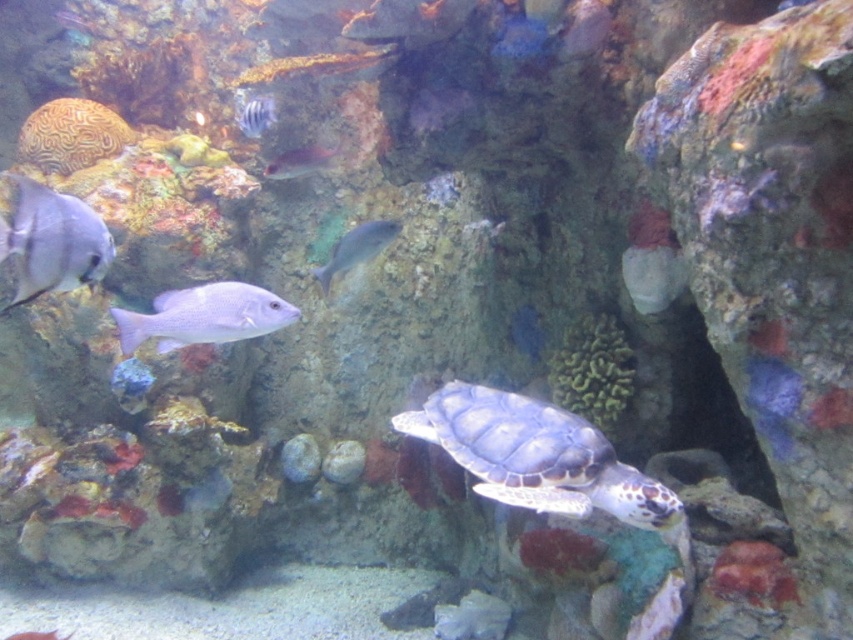
Based on the photo, you are a marine biologist observing this underwater scene. You notice the translucent pinkish fish at upper center and the shiny silver fish at lower left. Which fish is positioned higher in the water column?

The translucent pinkish fish at upper center is positioned higher in the water column than the shiny silver fish at lower left.

You are a marine biologist observing the underwater scene. You notice the satin silver fish at center. Can you determine its exact coordinates in the image?

The satin silver fish at center is located at coordinates point (357,248).

You are a marine biologist observing an underwater scene. You notice a point marked at coordinates (537, 456). Based on the scene description, which object does this point correspond to?

The point at coordinates (537, 456) corresponds to the leather like greenish brown turtle at center.